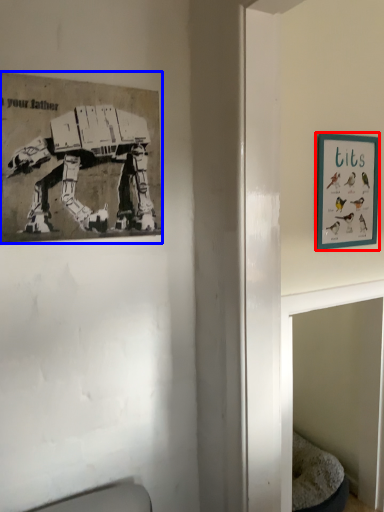
Question: Which object appears closest to the camera in this image, picture frame (highlighted by a red box) or picture frame (highlighted by a blue box)?

Choices:
 (A) picture frame
 (B) picture frame

Answer: (B)